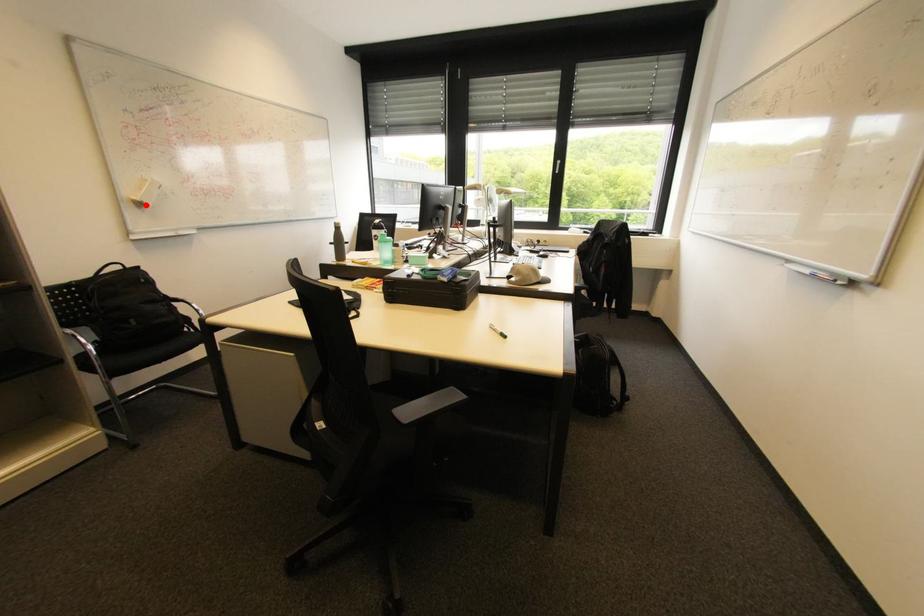
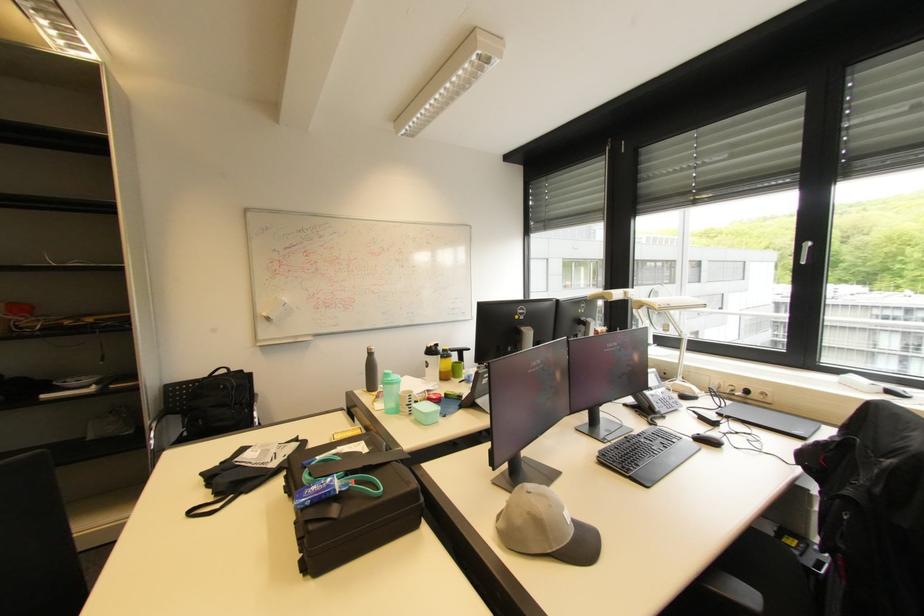
In the second image, find the point that corresponds to the highlighted location in the first image.

(273, 320)